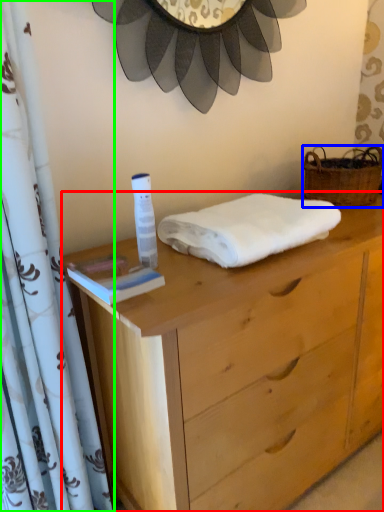
Question: Which object is the farthest from chest of drawers (highlighted by a red box)? Choose among these: picnic basket (highlighted by a blue box) or curtain (highlighted by a green box).

Choices:
 (A) picnic basket
 (B) curtain

Answer: (A)